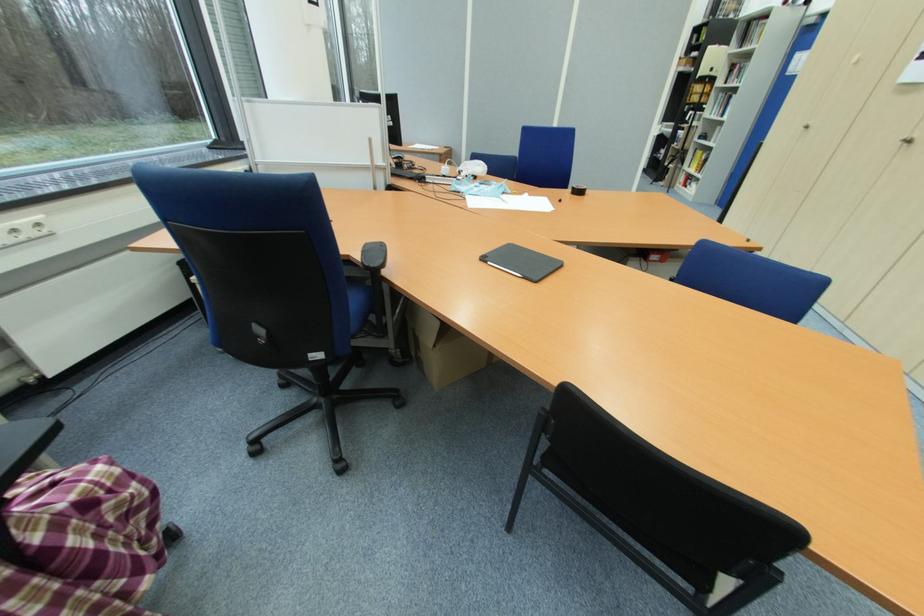
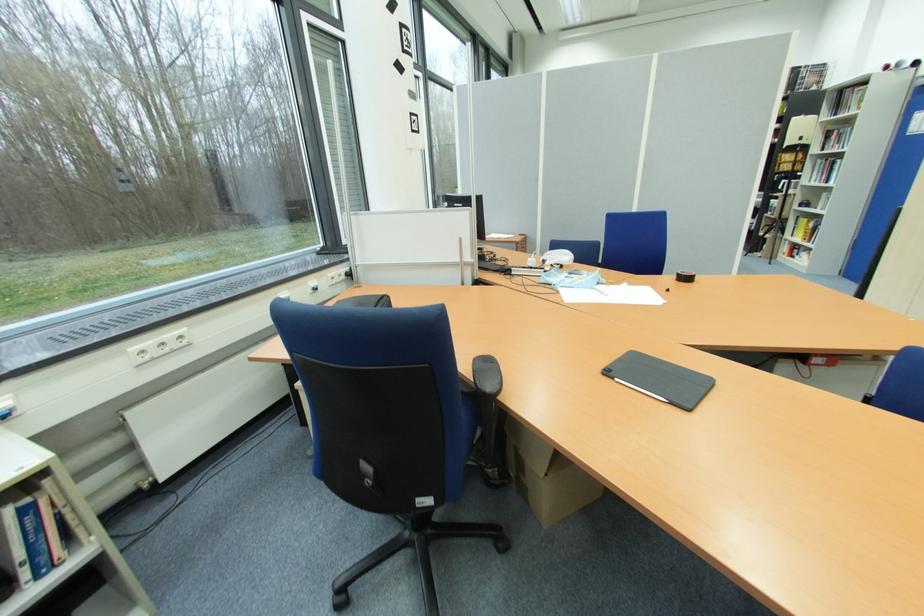
Question: Based on the continuous images, in which direction is the camera rotating? Reply with the corresponding letter.

Choices:
 (A) Left
 (B) Right
 (C) Up
 (D) Down

Answer: (C)